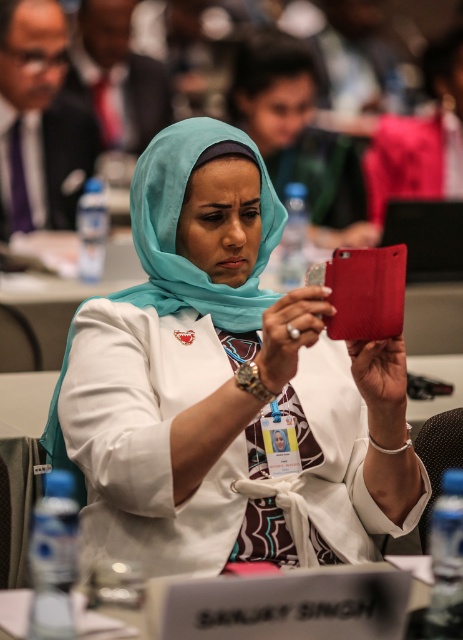
In the scene shown: You are standing in the conference room and want to move from point A to point B. Point A is at coordinate point (285,557) and point B is at coordinate point (32,221). Which point is closer to you when you first enter the room?

Point A at coordinate point (285,557) is closer to you when you first enter the room because it is closer to the viewer than point B at coordinate point (32,221).

You are standing at the position of the camera in the meeting room and want to take a photo of the woman holding the red smartphone. The point where you need to focus your camera is located at point (187, 132). If your camera has a minimum focusing distance of 1.5 meters, will you be able to take a clear photo of the woman?

The distance between point (187, 132) and the camera is 1.63 meters. Since the minimum focusing distance of the camera is 1.5 meters, the camera can focus on the woman holding the red smartphone at point (187, 132) because 1.63 meters is greater than 1.5 meters.